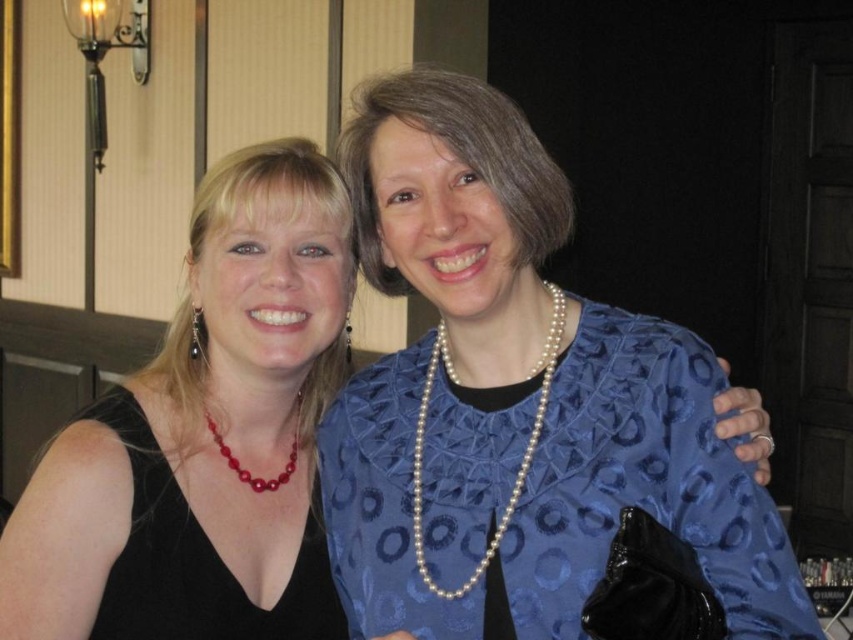
You are a photographer setting up for a portrait. You notice the matte black dress at left and the red pearl necklace at center. Which object is taller when viewed from the front?

The matte black dress at left is taller than the red pearl necklace at center.

You are a photographer setting up a shoot in a room with wooden paneling and a wall light. You need to position a model wearing the matte black dress at left so that it doesn not cast a shadow on the wall. Where should you place the light source relative to the dress?

The matte black dress at left is located at point (x=204, y=436). To prevent casting a shadow on the wall, the light source should be positioned directly behind the dress or at an angle where the shadow falls away from the wall.

You are a photographer setting up for a photoshoot. You need to position a spotlight so that it illuminates both the matte black dress at left and the blue satin dress at center. Considering their heights, which dress should you adjust the spotlight height to focus on first?

The matte black dress at left is taller than the blue satin dress at center, so you should adjust the spotlight height to focus on the matte black dress at left first to ensure proper illumination for both.